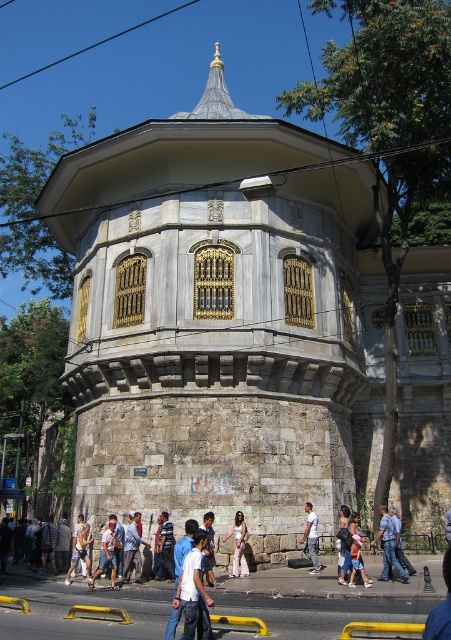
Is point (194, 556) farther from camera compared to point (317, 532)?

That is False.

Based on the photo, can you confirm if white cotton shirt at center is positioned to the left of light blue jeans at center?

Indeed, white cotton shirt at center is positioned on the left side of light blue jeans at center.

The height and width of the screenshot is (640, 451). What do you see at coordinates (193, 593) in the screenshot?
I see `white cotton shirt at center` at bounding box center [193, 593].

You are a GUI agent. You are given a task and a screenshot of the screen. Output one action in this format:
    pyautogui.click(x=<x>, y=<y>)
    Task: Click on the white cotton shirt at center
    The height and width of the screenshot is (640, 451).
    Given the screenshot: What is the action you would take?
    pyautogui.click(x=193, y=593)

Does denim jeans at center have a greater height compared to light blue jeans at center?

Incorrect, denim jeans at center's height is not larger of light blue jeans at center's.

Which is behind, point (173, 556) or point (317, 570)?

The point (317, 570) is more distant.

I want to click on denim jeans at center, so click(x=165, y=548).

Does white cotton shirt at center have a lesser width compared to blue denim jeans at center?

Answer: No, white cotton shirt at center is not thinner than blue denim jeans at center.

Who is shorter, white cotton shirt at center or blue denim jeans at center?

With less height is white cotton shirt at center.

Image resolution: width=451 pixels, height=640 pixels. Find the location of `white cotton shirt at center`. white cotton shirt at center is located at coordinates (193, 593).

At what (x,y) coordinates should I click in order to perform the action: click on white cotton shirt at center. Please return your answer as a coordinate pair (x, y). Looking at the image, I should click on (193, 593).